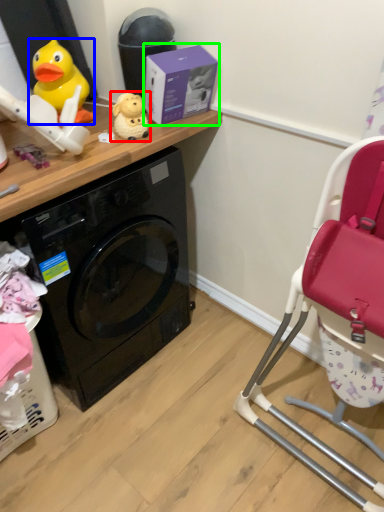
Question: Which object is the closest to the toy (highlighted by a red box)? Choose among these: toy (highlighted by a blue box) or box (highlighted by a green box).

Choices:
 (A) toy
 (B) box

Answer: (B)